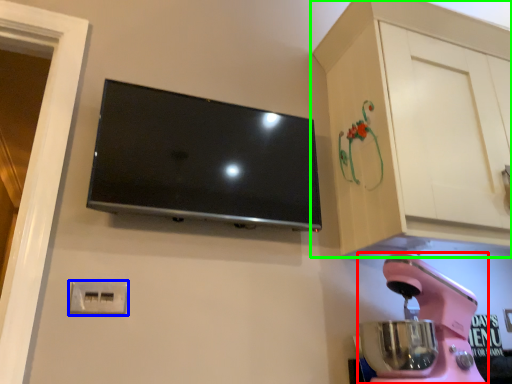
Question: Which object is positioned closest to home appliance (highlighted by a red box)? Select from electric outlet (highlighted by a blue box) and cabinetry (highlighted by a green box).

Choices:
 (A) electric outlet
 (B) cabinetry

Answer: (B)